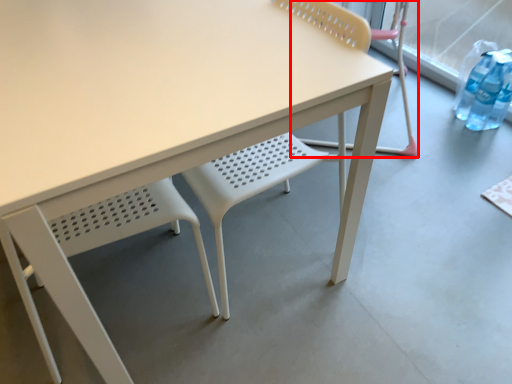
Question: From the image's perspective, what is the correct spatial relationship of chair (annotated by the red box) in relation to chair?

Choices:
 (A) below
 (B) above

Answer: (B)